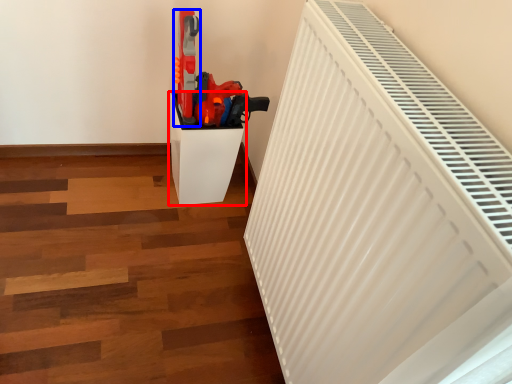
Question: Which object appears closest to the camera in this image, furniture (highlighted by a red box) or equipment (highlighted by a blue box)?

Choices:
 (A) furniture
 (B) equipment

Answer: (B)